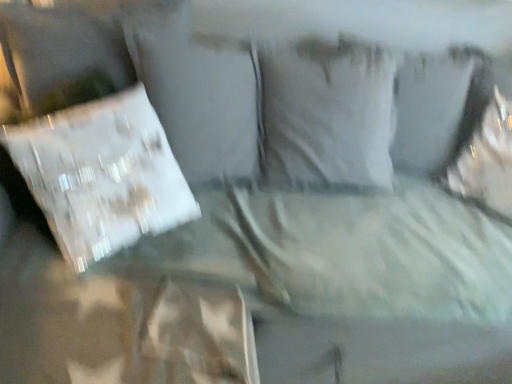
Looking at this image, in order to face white fabric pillow at left, should I rotate leftwards or rightwards?

Rotate left and turn 18.408 degrees.

Where is `white fabric pillow at left`? The image size is (512, 384). white fabric pillow at left is located at coordinates (102, 175).

What do you see at coordinates (102, 175) in the screenshot?
I see `white fabric pillow at left` at bounding box center [102, 175].

You are a GUI agent. You are given a task and a screenshot of the screen. Output one action in this format:
    pyautogui.click(x=<x>, y=<y>)
    Task: Click on the white fabric pillow at left
    The height and width of the screenshot is (384, 512).
    Given the screenshot: What is the action you would take?
    pyautogui.click(x=102, y=175)